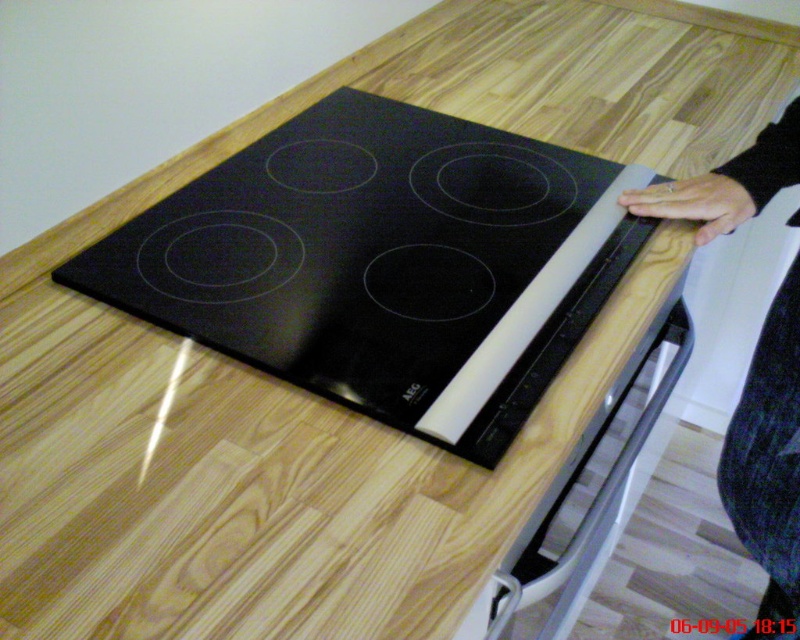
Question: Is black glass cooktop at center positioned behind black matte hand at upper right?

Choices:
 (A) no
 (B) yes

Answer: (A)

Question: Does black glass cooktop at center appear on the right side of black matte hand at upper right?

Choices:
 (A) yes
 (B) no

Answer: (B)

Question: Among these points, which one is farthest from the camera?

Choices:
 (A) (233, 173)
 (B) (748, 212)

Answer: (A)

Question: Is black glass cooktop at center positioned at the back of black matte hand at upper right?

Choices:
 (A) no
 (B) yes

Answer: (A)